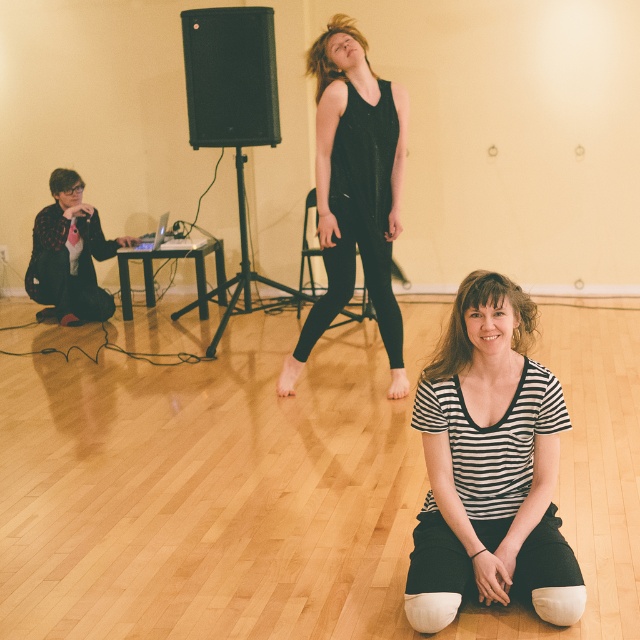
Question: Which of the following is the closest to the observer?

Choices:
 (A) click(99, 252)
 (B) click(472, 371)
 (C) click(358, 90)

Answer: (B)

Question: Can you confirm if black striped shirt at lower center is positioned below black matte tank top at center?

Choices:
 (A) yes
 (B) no

Answer: (A)

Question: Which point is closer to the camera?

Choices:
 (A) (422, 573)
 (B) (83, 244)
 (C) (342, 188)

Answer: (A)

Question: Is black matte tank top at center behind flannel shirt at left?

Choices:
 (A) yes
 (B) no

Answer: (B)

Question: Is black striped shirt at lower center smaller than black matte tank top at center?

Choices:
 (A) yes
 (B) no

Answer: (A)

Question: Among these points, which one is nearest to the camera?

Choices:
 (A) (326, 28)
 (B) (460, 442)

Answer: (B)